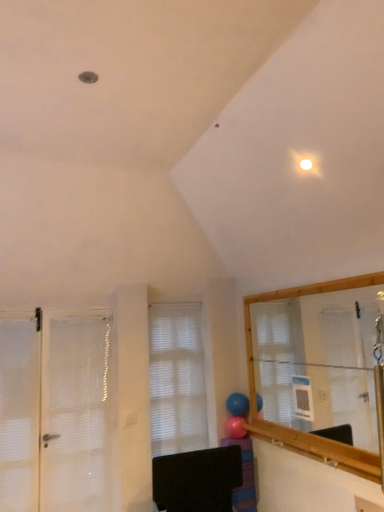
Question: Considering the relative positions of white matte window at center and rubber blue balloon at center, which is the 1th balloon from top to bottom, in the image provided, is white matte window at center to the left or to the right of rubber blue balloon at center, which is the 1th balloon from top to bottom,?

Choices:
 (A) left
 (B) right

Answer: (A)

Question: From the image's perspective, is white matte window at center positioned above or below rubber blue balloon at center, which is the 1th balloon from top to bottom?

Choices:
 (A) above
 (B) below

Answer: (B)

Question: Based on their relative distances, which object is nearer to the pink rubber balloon at center, which is counted as the first balloon, starting from the bottom?

Choices:
 (A) white matte window at center
 (B) purple striped socks at lower center
 (C) rubber blue balloon at center, which is the second balloon in bottom-to-top order
 (D) white mesh door at left

Answer: (C)

Question: Estimate the real-world distances between objects in this image. Which object is closer to the rubber blue balloon at center, which is the 1th balloon from top to bottom?

Choices:
 (A) pink rubber balloon at center, which ranks as the 2th balloon in top-to-bottom order
 (B) white mesh door at left
 (C) white matte window at center
 (D) purple striped socks at lower center

Answer: (A)